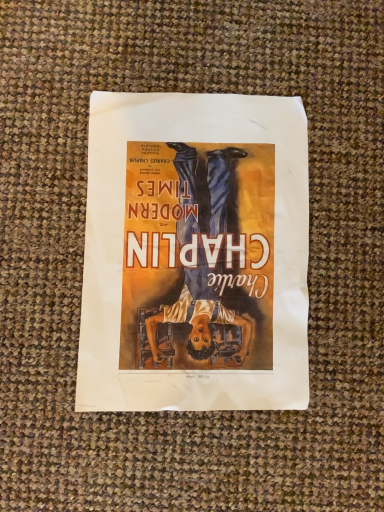
Identify the location of free location above matte paper poster at center (from a real-world perspective). (193, 247).